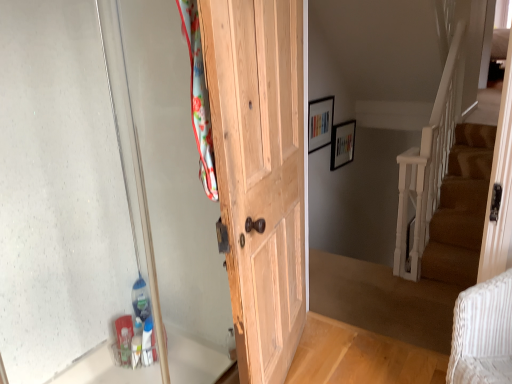
Question: Is natural wood door at center smaller than wooden picture frame at upper center, positioned as the second picture frame in right-to-left order?

Choices:
 (A) no
 (B) yes

Answer: (A)

Question: Is natural wood door at center thinner than wooden picture frame at upper center, the 1th picture frame positioned from the left?

Choices:
 (A) no
 (B) yes

Answer: (A)

Question: Is natural wood door at center outside of wooden picture frame at upper center, positioned as the second picture frame in right-to-left order?

Choices:
 (A) yes
 (B) no

Answer: (A)

Question: Does natural wood door at center have a greater height compared to wooden picture frame at upper center, the second picture frame positioned from the back?

Choices:
 (A) yes
 (B) no

Answer: (A)

Question: Is the depth of natural wood door at center less than that of wooden picture frame at upper center, the second picture frame positioned from the back?

Choices:
 (A) yes
 (B) no

Answer: (A)

Question: Is wooden picture frame at upper center, placed as the 1th picture frame when sorted from right to left, in front of or behind natural wood door at center in the image?

Choices:
 (A) front
 (B) behind

Answer: (B)

Question: Considering the relative positions of wooden picture frame at upper center, arranged as the first picture frame when viewed from the back, and natural wood door at center in the image provided, is wooden picture frame at upper center, arranged as the first picture frame when viewed from the back, to the left or to the right of natural wood door at center?

Choices:
 (A) left
 (B) right

Answer: (B)

Question: From the image's perspective, is wooden picture frame at upper center, placed as the 1th picture frame when sorted from right to left, positioned above or below natural wood door at center?

Choices:
 (A) below
 (B) above

Answer: (B)

Question: From a real-world perspective, relative to natural wood door at center, is wooden picture frame at upper center, the 2th picture frame viewed from the left, vertically above or below?

Choices:
 (A) above
 (B) below

Answer: (B)

Question: Based on their positions, is wooden picture frame at upper center, which is counted as the 2th picture frame, starting from the front, located to the left or right of transparent glass door at left?

Choices:
 (A) right
 (B) left

Answer: (A)

Question: Is wooden picture frame at upper center, which is counted as the 2th picture frame, starting from the front, situated inside transparent glass door at left or outside?

Choices:
 (A) inside
 (B) outside

Answer: (B)

Question: Is point (335, 137) closer or farther from the camera than point (60, 359)?

Choices:
 (A) farther
 (B) closer

Answer: (A)

Question: From a real-world perspective, relative to transparent glass door at left, is wooden picture frame at upper center, the 2th picture frame viewed from the left, vertically above or below?

Choices:
 (A) above
 (B) below

Answer: (B)

Question: Is wooden picture frame at upper center, the second picture frame positioned from the back, bigger or smaller than natural wood door at center?

Choices:
 (A) small
 (B) big

Answer: (A)

Question: Considering the positions of wooden picture frame at upper center, the second picture frame positioned from the back, and natural wood door at center in the image, is wooden picture frame at upper center, the second picture frame positioned from the back, wider or thinner than natural wood door at center?

Choices:
 (A) thin
 (B) wide

Answer: (A)